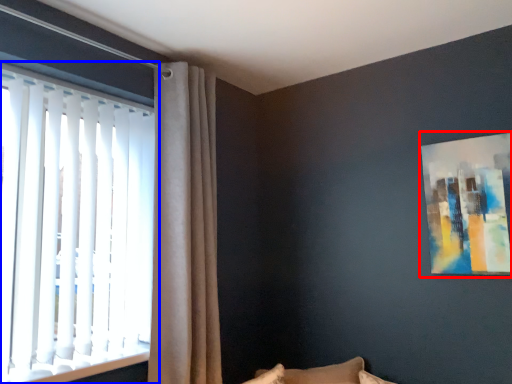
Question: Which object appears closest to the camera in this image, picture frame (highlighted by a red box) or window (highlighted by a blue box)?

Choices:
 (A) picture frame
 (B) window

Answer: (B)